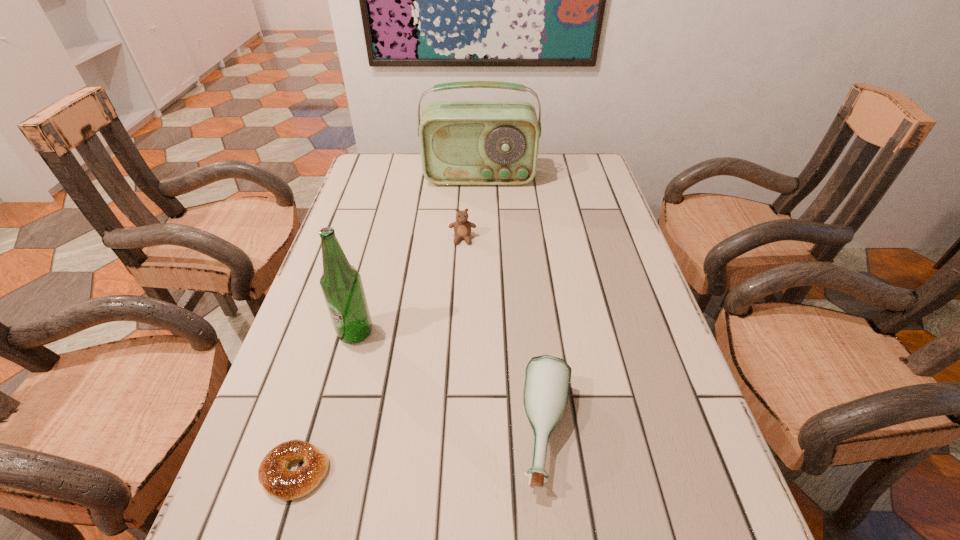
The width and height of the screenshot is (960, 540). Identify the location of free spot between the teddy bear and the radio receiver. (471, 208).

Find the location of a particular element. free space that is in between the third farthest object and the farthest object is located at coordinates (418, 255).

The height and width of the screenshot is (540, 960). In order to click on unoccupied position between the third nearest object and the farthest object in this screenshot , I will do `click(418, 255)`.

At what (x,y) coordinates should I click in order to perform the action: click on empty space that is in between the bottle and the third farthest object. Please return your answer as a coordinate pair (x, y). Looking at the image, I should click on (451, 383).

The image size is (960, 540). What are the coordinates of `free area in between the beer bottle and the bottle` in the screenshot? It's located at (451, 383).

This screenshot has width=960, height=540. In order to click on unoccupied area between the bagel and the bottle in this screenshot , I will do (x=421, y=452).

At what (x,y) coordinates should I click in order to perform the action: click on vacant space that is in between the bottle and the third nearest object. Please return your answer as a coordinate pair (x, y). Image resolution: width=960 pixels, height=540 pixels. Looking at the image, I should click on (451, 383).

Locate an element on the screen. This screenshot has height=540, width=960. vacant region between the bottle and the shortest object is located at coordinates (421, 452).

Identify which object is the third closest to the bottle. Please provide its 2D coordinates. Your answer should be formatted as a tuple, i.e. [(x, y)], where the tuple contains the x and y coordinates of a point satisfying the conditions above.

[(462, 227)]

This screenshot has height=540, width=960. What are the coordinates of `object that is the fourth closest to the third farthest object` in the screenshot? It's located at (462, 142).